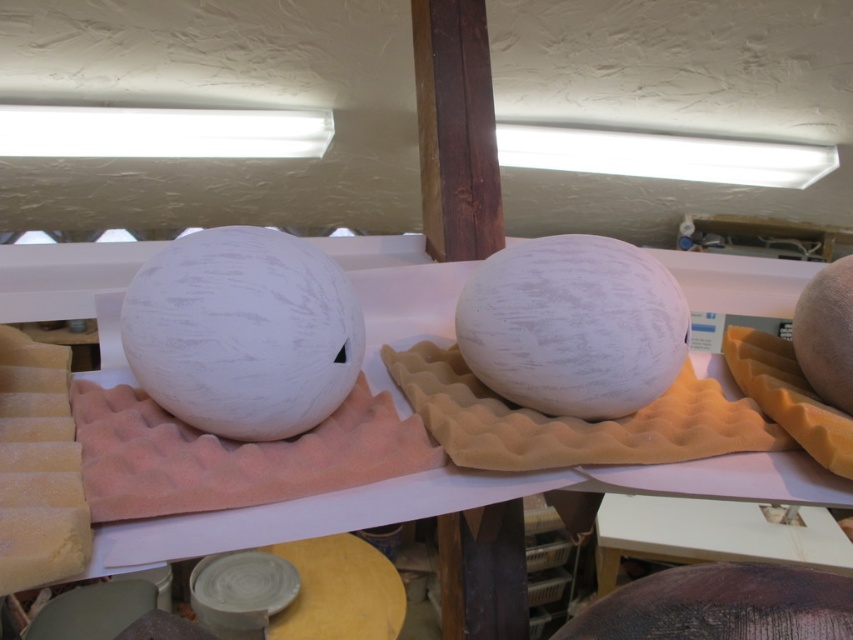
You are standing in a pottery studio and see a point marked at coordinates point (262, 264). If you want to reach that point with a 32 inch long tool, will you be able to do so?

The distance between point (262, 264) and the camera is 33.53 inches. Since the tool is only 32 inches long, it is slightly shorter than the required distance. Therefore, you won not be able to reach the point with the tool.